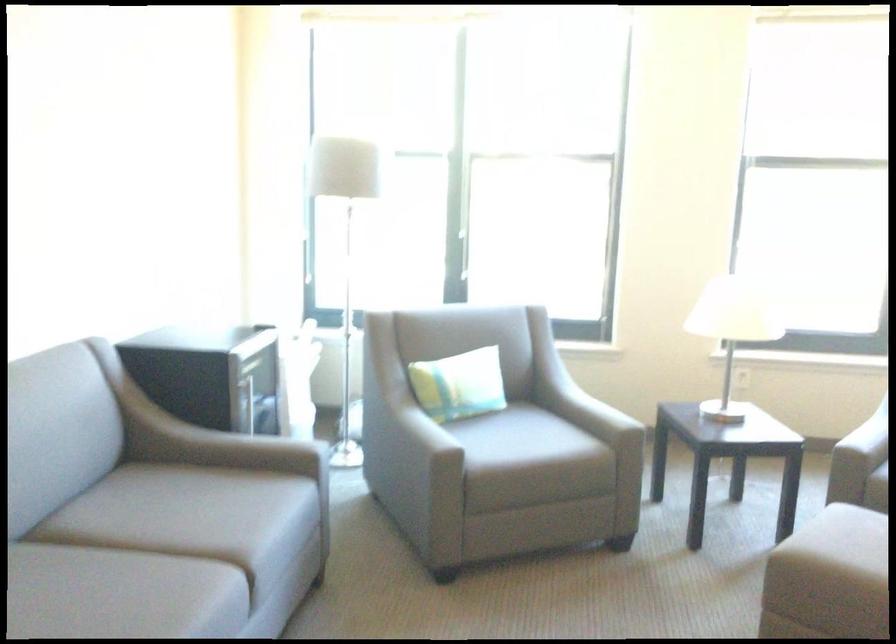
Locate an element on the screen. The width and height of the screenshot is (896, 644). ottoman sitting surface is located at coordinates (849, 536).